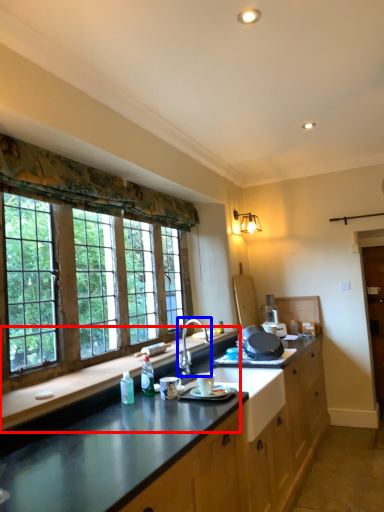
Question: Which object appears closest to the camera in this image, countertop (highlighted by a red box) or sink (highlighted by a blue box)?

Choices:
 (A) countertop
 (B) sink

Answer: (A)